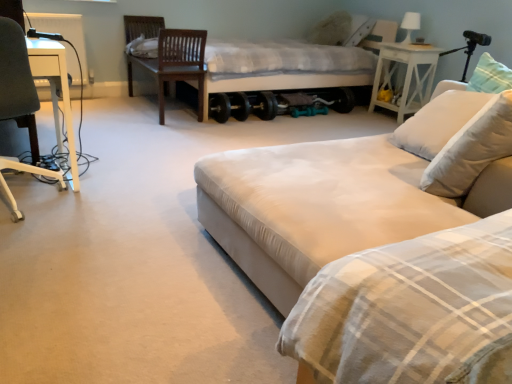
Find the location of a particular element. blank space to the left of white fabric bed at center, which is the 2th bed in back-to-front order is located at coordinates (129, 243).